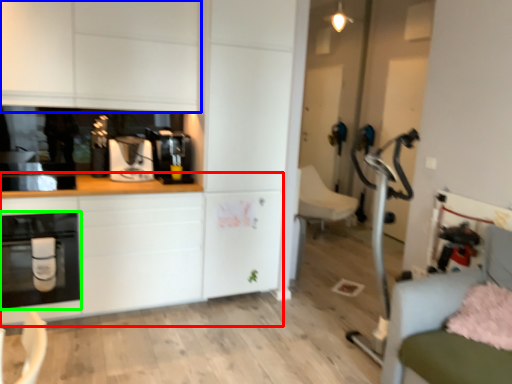
Question: Estimate the real-world distances between objects in this image. Which object is farther from counter top (highlighted by a red box), cabinetry (highlighted by a blue box) or home appliance (highlighted by a green box)?

Choices:
 (A) cabinetry
 (B) home appliance

Answer: (A)